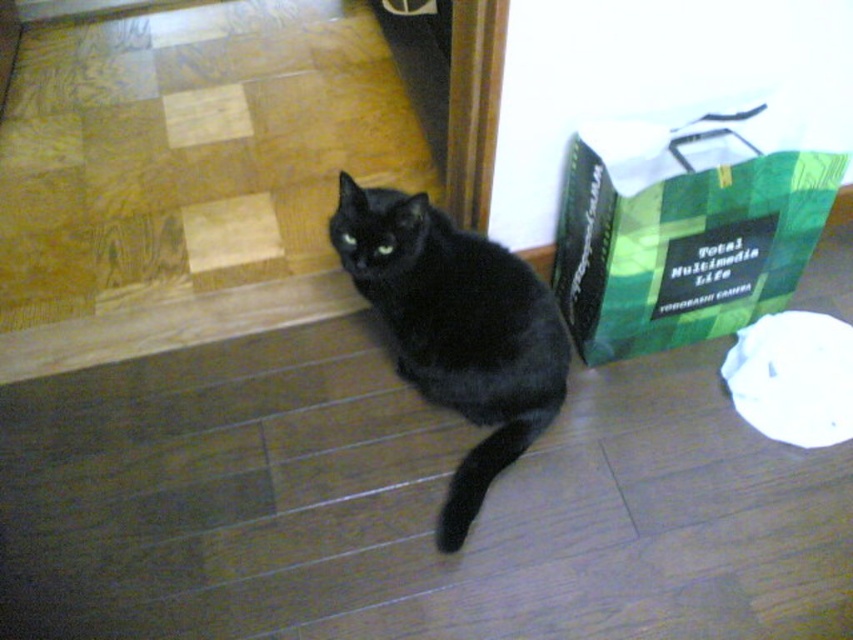
Which of these two, green paper shopping bag at right or black fur cat at center, stands taller?

black fur cat at center

Does green paper shopping bag at right appear on the left side of black fur cat at center?

In fact, green paper shopping bag at right is to the right of black fur cat at center.

Does point (653, 260) come in front of point (451, 476)?

Yes, it is in front of point (451, 476).

At what (x,y) coordinates should I click in order to perform the action: click on green paper shopping bag at right. Please return your answer as a coordinate pair (x, y). This screenshot has width=853, height=640. Looking at the image, I should click on (685, 227).